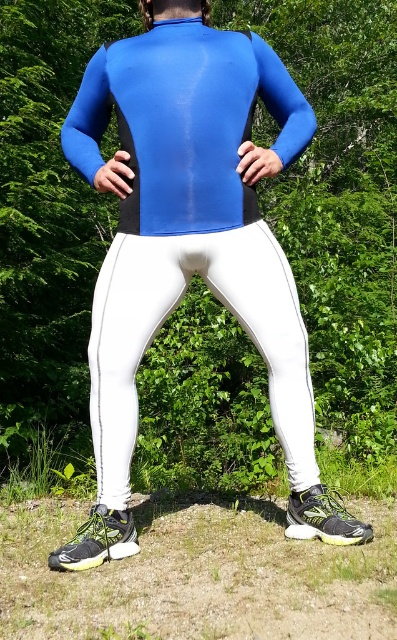
You are a fashion designer analyzing the outfit of a person in a forest setting. Given the coordinates provided, can you identify which clothing item is located at point (169, 314)?

The white matte leggings at center is represented by point (169, 314).

You are a photographer setting up a shoot in the forest. You need to position a tripod so that it is between the white matte leggings at center and the green grass at lower center. Based on their positions, which object should the tripod be closer to?

The white matte leggings at center is to the right of green grass at lower center, so the tripod should be placed closer to the green grass at lower center to be between them.

You are a photographer positioned at a certain distance from the subject. You want to capture a closeup shot of the white matte leggings at center. Given that your camera has a minimum focusing distance of 5 feet, will you be able to achieve this closeup without moving closer?

The white matte leggings at center are 5.55 feet away from the camera. Since the minimum focusing distance is 5 feet, the photographer can capture the closeup without moving closer because the distance is within the camera capabilities.